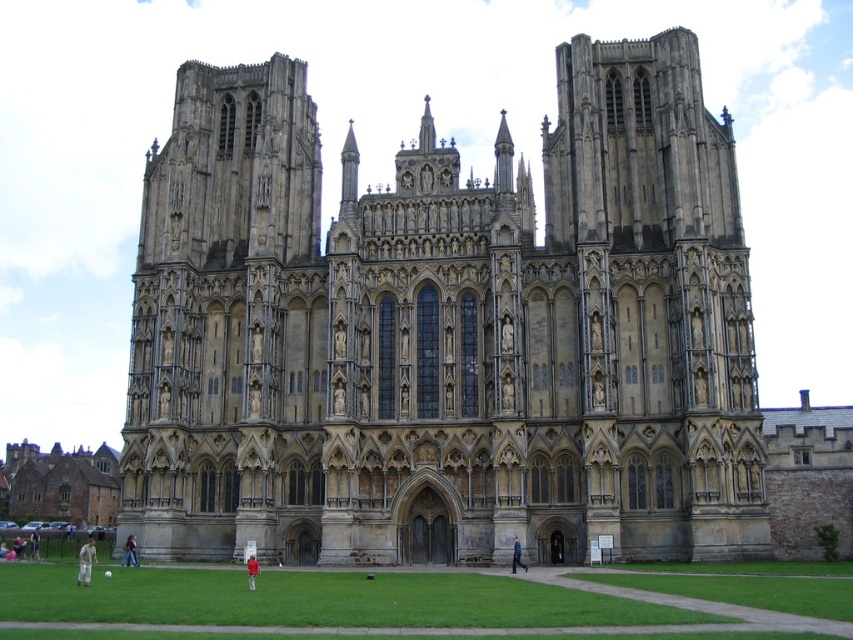
Question: Can you confirm if stone church at center is thinner than brown stone church at lower left?

Choices:
 (A) yes
 (B) no

Answer: (B)

Question: Can you confirm if stone church at center is positioned below brown stone church at lower left?

Choices:
 (A) no
 (B) yes

Answer: (A)

Question: Which point is closer to the camera?

Choices:
 (A) brown stone church at lower left
 (B) stone church at center

Answer: (B)

Question: Does stone church at center have a smaller size compared to brown stone church at lower left?

Choices:
 (A) yes
 (B) no

Answer: (B)